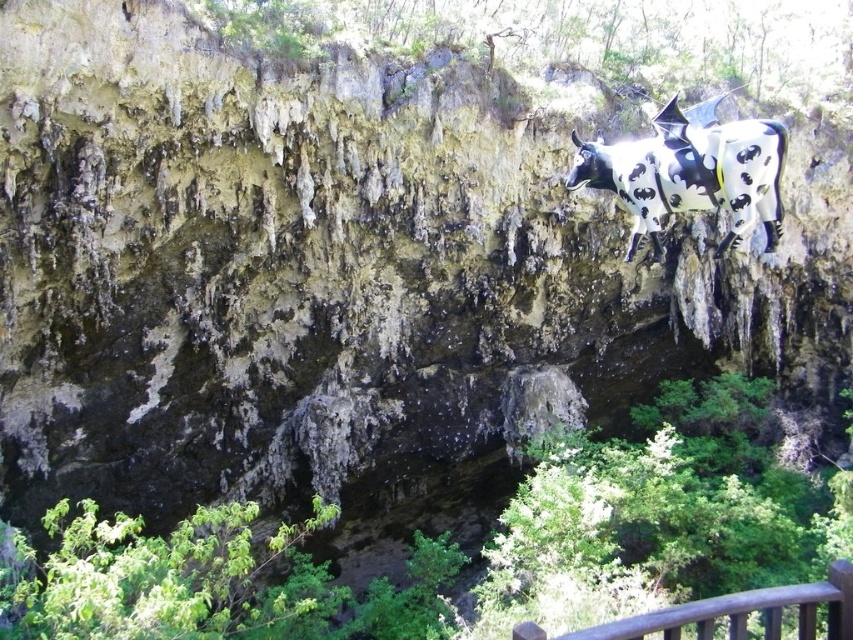
Can you confirm if black and white spotted cow at upper right is positioned to the right of brown wooden rail at lower right?

Indeed, black and white spotted cow at upper right is positioned on the right side of brown wooden rail at lower right.

Does black and white spotted cow at upper right appear on the left side of brown wooden rail at lower right?

In fact, black and white spotted cow at upper right is to the right of brown wooden rail at lower right.

Which is behind, point (750, 193) or point (520, 634)?

Point (750, 193)

The width and height of the screenshot is (853, 640). In order to click on black and white spotted cow at upper right in this screenshot , I will do `click(689, 172)`.